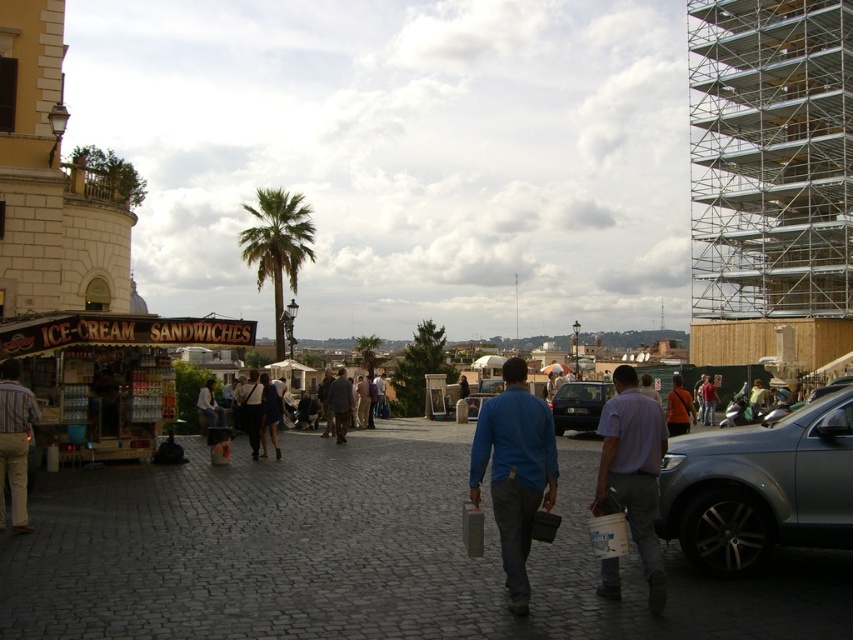
You are a tourist in this European city and want to take a photo of the green leafy palm tree at upper left and the blue matte jacket at center in the same frame. Based on their positions, which object should you position closer to the left side of your camera viewfinder to include both?

To include both the green leafy palm tree at upper left and the blue matte jacket at center in the same frame, position the green leafy palm tree at upper left closer to the left side of your camera viewfinder since the blue matte jacket at center is already to its right.

You are standing in the middle of the street and see two points in the scene. The first point is at coordinate point (x=9, y=365) and the second point is at coordinate point (x=573, y=397). Which point is physically closer to you?

Point (x=9, y=365) is closer to the camera than point (x=573, y=397), so the first point is physically closer to you.

You are a photographer standing in the urban scene. You want to take a photo of the green leafy palm tree at upper left without the blue matte jacket at center blocking it. What should you do?

Move to the side so that the blue matte jacket at center is no longer in front of the green leafy palm tree at upper left.